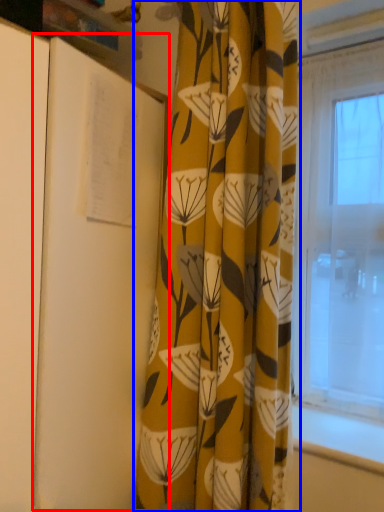
Question: Among these objects, which one is nearest to the camera, notebook (highlighted by a red box) or curtain (highlighted by a blue box)?

Choices:
 (A) notebook
 (B) curtain

Answer: (A)